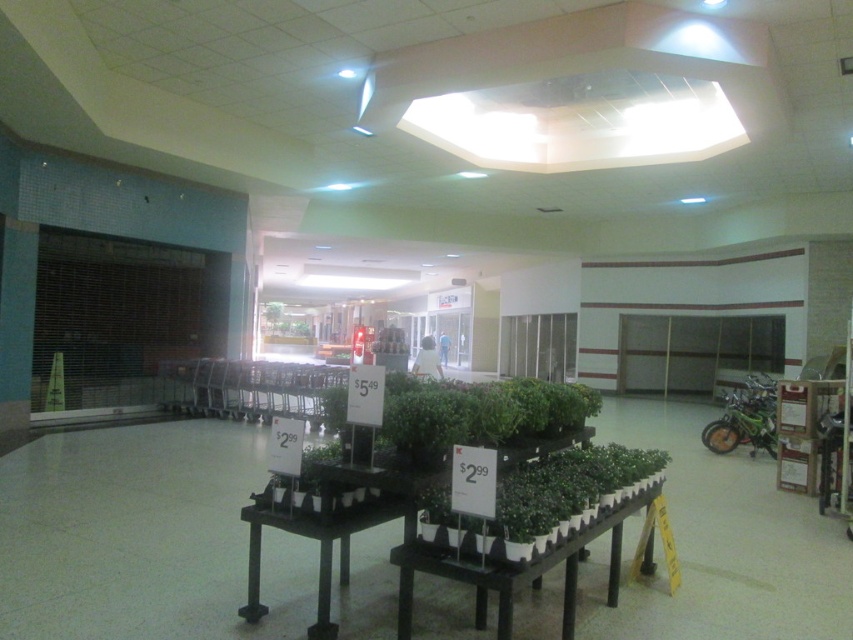
You are a customer looking to buy a plant and need to place your items on a table. The black matte table at center and the black plastic table at center are both available. If you want to place your items on the table that is taller, which one should you choose?

The black matte table at center is taller than the black plastic table at center, so you should choose the black matte table at center.